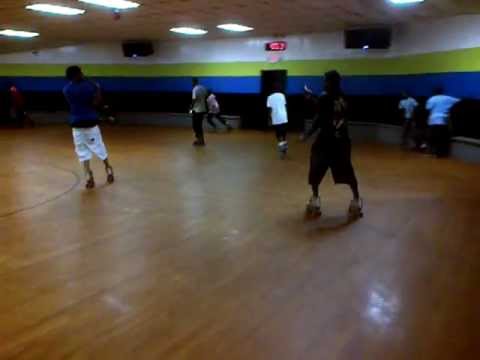
This screenshot has width=480, height=360. What are the coordinates of `light` in the screenshot? It's located at (187, 30).